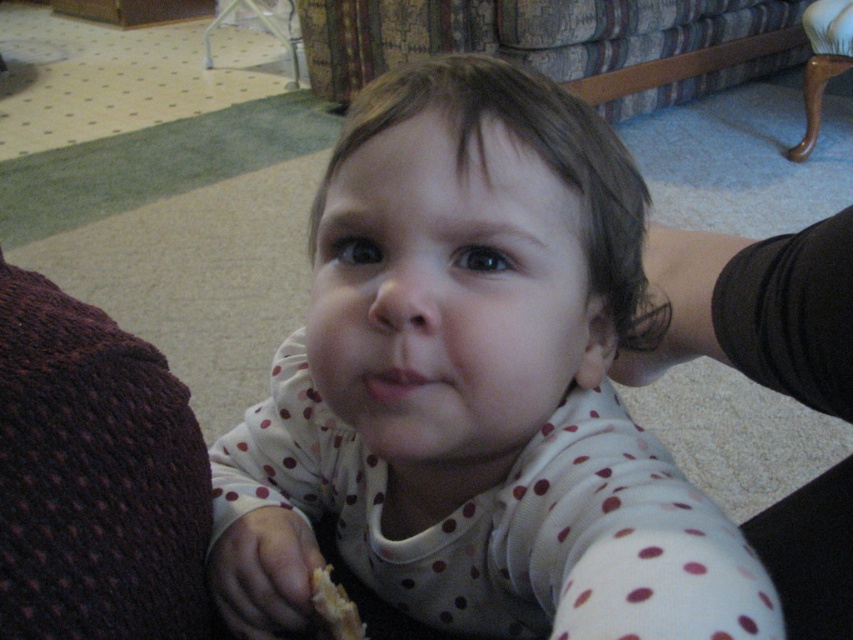
Can you confirm if white polka dot onesie at center is positioned below dark purple knitted sweater at left?

Indeed, white polka dot onesie at center is positioned under dark purple knitted sweater at left.

Is white polka dot onesie at center smaller than dark purple knitted sweater at left?

Incorrect, white polka dot onesie at center is not smaller in size than dark purple knitted sweater at left.

Who is more forward, [437,225] or [190,620]?

Point [437,225] is in front.

Find the location of `white polka dot onesie at center`. white polka dot onesie at center is located at coordinates (474, 388).

Which is more to the left, dark purple knitted sweater at left or crumbly bread at lower left?

dark purple knitted sweater at left

Does point (32, 506) come behind point (323, 572)?

No, it is not.

Where is `dark purple knitted sweater at left`? The height and width of the screenshot is (640, 853). dark purple knitted sweater at left is located at coordinates (94, 477).

Can you confirm if white polka dot onesie at center is positioned below crumbly bread at lower left?

No.

Does white polka dot onesie at center have a lesser width compared to crumbly bread at lower left?

No.

The image size is (853, 640). I want to click on white polka dot onesie at center, so click(474, 388).

This screenshot has height=640, width=853. What are the coordinates of `white polka dot onesie at center` in the screenshot? It's located at (474, 388).